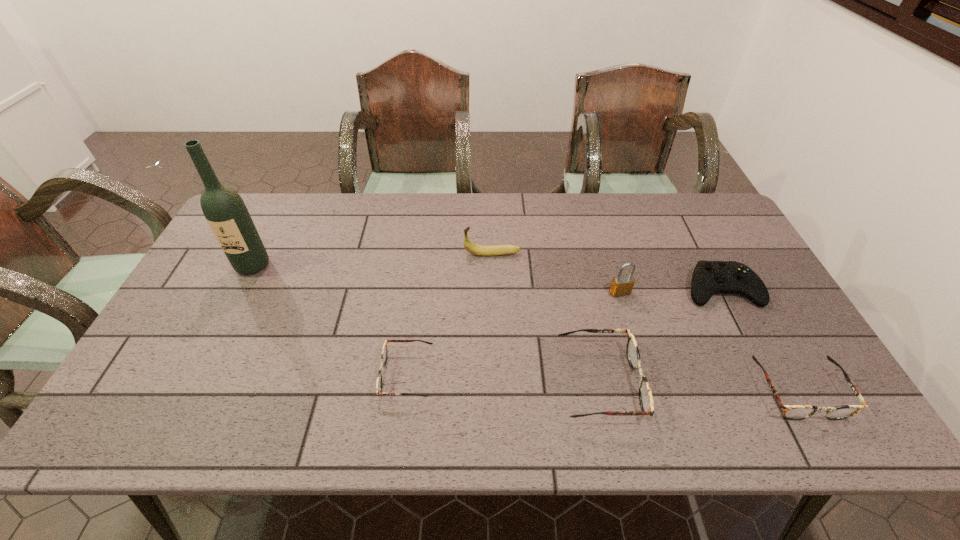
The image size is (960, 540). I want to click on spectacles that is the third closest to the wine bottle, so pyautogui.click(x=790, y=412).

The width and height of the screenshot is (960, 540). What are the coordinates of `spectacles object that ranks as the closest to the leftmost object` in the screenshot? It's located at (384, 354).

What are the coordinates of `vacant space that satisfies the following two spatial constraints: 1. at the stem of the padlock; 2. on the left side of the banana` in the screenshot? It's located at (493, 292).

You are a GUI agent. You are given a task and a screenshot of the screen. Output one action in this format:
    pyautogui.click(x=<x>, y=<y>)
    Task: Click on the vacant space that satisfies the following two spatial constraints: 1. on the front side of the control; 2. on the frame of the tallest spectacles
    
    Given the screenshot: What is the action you would take?
    pyautogui.click(x=769, y=382)

What are the coordinates of `blank area in the image that satisfies the following two spatial constraints: 1. on the front side of the padlock; 2. on the frame of the tallest spectacles` in the screenshot? It's located at [x=646, y=382].

The image size is (960, 540). What are the coordinates of `free region that satisfies the following two spatial constraints: 1. at the stem of the banana; 2. on the labeled side of the tallest object` in the screenshot? It's located at (492, 265).

The width and height of the screenshot is (960, 540). I want to click on vacant position in the image that satisfies the following two spatial constraints: 1. on the labeled side of the padlock; 2. on the left side of the wine bottle, so click(239, 292).

Identify the location of vacant space that satisfies the following two spatial constraints: 1. on the front side of the padlock; 2. on the frame of the shortest spectacles. This screenshot has height=540, width=960. (644, 374).

You are a GUI agent. You are given a task and a screenshot of the screen. Output one action in this format:
    pyautogui.click(x=<x>, y=<y>)
    Task: Click on the vacant space that satisfies the following two spatial constraints: 1. on the back side of the control; 2. on the left side of the padlock
    
    Given the screenshot: What is the action you would take?
    pyautogui.click(x=618, y=289)